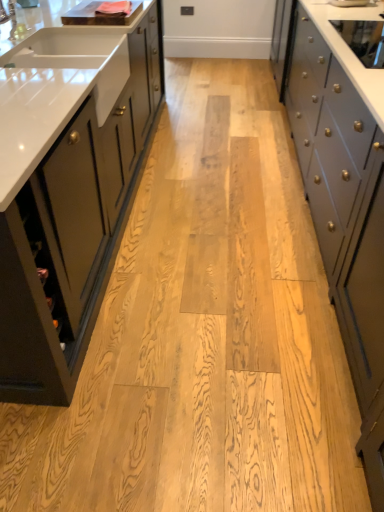
Question: Can you confirm if matte dark green cabinet at left, which ranks as the 1th cabinetry in left-to-right order, is shorter than silver metallic faucet at upper left?

Choices:
 (A) yes
 (B) no

Answer: (B)

Question: From a real-world perspective, is matte dark green cabinet at left, which ranks as the 1th cabinetry in left-to-right order, located beneath silver metallic faucet at upper left?

Choices:
 (A) no
 (B) yes

Answer: (B)

Question: Could you tell me if matte dark green cabinet at left, which ranks as the 1th cabinetry in left-to-right order, is turned towards silver metallic faucet at upper left?

Choices:
 (A) no
 (B) yes

Answer: (A)

Question: Considering the relative sizes of matte dark green cabinet at left, which ranks as the 1th cabinetry in left-to-right order, and silver metallic faucet at upper left in the image provided, is matte dark green cabinet at left, which ranks as the 1th cabinetry in left-to-right order, wider than silver metallic faucet at upper left?

Choices:
 (A) yes
 (B) no

Answer: (A)

Question: Is matte dark green cabinet at left, which ranks as the 1th cabinetry in left-to-right order, to the left of silver metallic faucet at upper left from the viewer's perspective?

Choices:
 (A) no
 (B) yes

Answer: (B)

Question: Is silver metallic faucet at upper left wider or thinner than matte dark green cabinet at left, the second cabinetry when ordered from right to left?

Choices:
 (A) wide
 (B) thin

Answer: (B)

Question: Looking at the image, does silver metallic faucet at upper left seem bigger or smaller compared to matte dark green cabinet at left, which ranks as the 1th cabinetry in left-to-right order?

Choices:
 (A) big
 (B) small

Answer: (B)

Question: From a real-world perspective, is silver metallic faucet at upper left above or below matte dark green cabinet at left, the second cabinetry when ordered from right to left?

Choices:
 (A) above
 (B) below

Answer: (A)

Question: From the image's perspective, is silver metallic faucet at upper left positioned above or below matte dark green cabinet at left, which ranks as the 1th cabinetry in left-to-right order?

Choices:
 (A) below
 (B) above

Answer: (B)

Question: From a real-world perspective, is silver metallic faucet at upper left above or below gray matte cabinet at right, which appears as the first cabinetry when viewed from the right?

Choices:
 (A) above
 (B) below

Answer: (A)

Question: Is point (8, 13) positioned closer to the camera than point (304, 4)?

Choices:
 (A) farther
 (B) closer

Answer: (B)

Question: From the image's perspective, relative to gray matte cabinet at right, which appears as the first cabinetry when viewed from the right, is silver metallic faucet at upper left above or below?

Choices:
 (A) above
 (B) below

Answer: (A)

Question: In terms of height, does silver metallic faucet at upper left look taller or shorter compared to gray matte cabinet at right, which appears as the first cabinetry when viewed from the right?

Choices:
 (A) tall
 (B) short

Answer: (B)

Question: Is point (26, 179) positioned closer to the camera than point (16, 25)?

Choices:
 (A) closer
 (B) farther

Answer: (A)

Question: From the image's perspective, is matte dark green cabinet at left, which ranks as the 1th cabinetry in left-to-right order, above or below silver metallic faucet at upper left?

Choices:
 (A) below
 (B) above

Answer: (A)